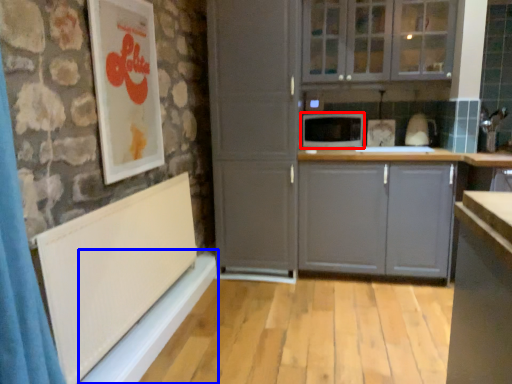
Question: Which point is further to the camera, microwave oven (highlighted by a red box) or window sill (highlighted by a blue box)?

Choices:
 (A) microwave oven
 (B) window sill

Answer: (A)